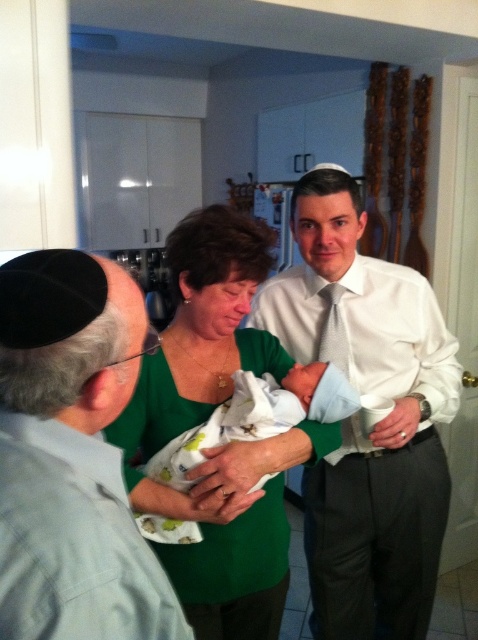
Question: Can you confirm if matte green sweater at center is smaller than white swaddled newborn at center?

Choices:
 (A) no
 (B) yes

Answer: (A)

Question: Does white cotton baby at center have a larger size compared to white swaddled newborn at center?

Choices:
 (A) no
 (B) yes

Answer: (B)

Question: Among these objects, which one is farthest from the camera?

Choices:
 (A) green fabric shirt at center
 (B) white swaddled newborn at center
 (C) white cotton baby at center

Answer: (C)

Question: Estimate the real-world distances between objects in this image. Which object is farther from the black fabric kippah at upper left?

Choices:
 (A) matte green sweater at center
 (B) green fabric shirt at center
 (C) white cotton baby at center

Answer: (C)

Question: Which point is farther to the camera?

Choices:
 (A) (223, 349)
 (B) (162, 593)

Answer: (A)

Question: Can you confirm if matte green sweater at center is positioned to the left of black fabric kippah at upper left?

Choices:
 (A) no
 (B) yes

Answer: (A)